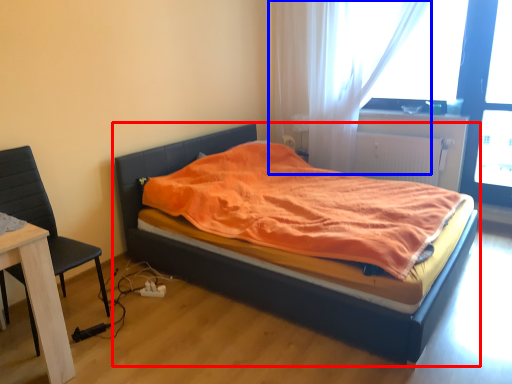
Question: Which of the following is the closest to the observer, bed (highlighted by a red box) or curtain (highlighted by a blue box)?

Choices:
 (A) bed
 (B) curtain

Answer: (A)